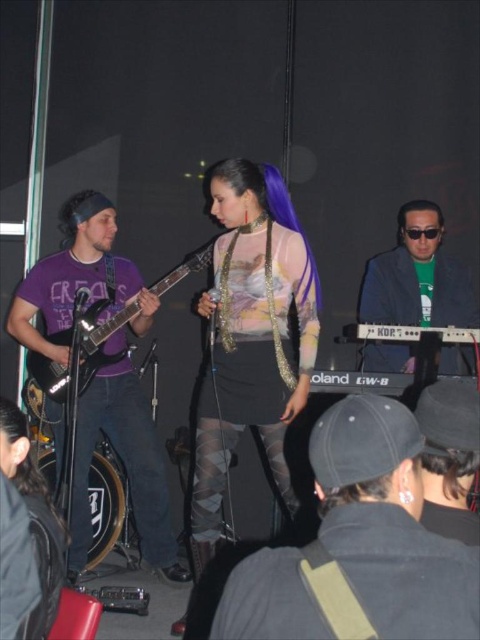
Where is `matte black electric guitar at left`? matte black electric guitar at left is located at coordinates (100, 337).

Does matte black electric guitar at left lie behind purple silky hair at center?

Yes, it is behind purple silky hair at center.

What do you see at coordinates (100, 337) in the screenshot? The height and width of the screenshot is (640, 480). I see `matte black electric guitar at left` at bounding box center [100, 337].

Where is `matte black electric guitar at left`? matte black electric guitar at left is located at coordinates (100, 337).

Which is more to the right, green matte keyboard at center or black silky hair at upper right?

black silky hair at upper right is more to the right.

Is green matte keyboard at center closer to camera compared to black silky hair at upper right?

Yes, it is.

Is point (419, 264) more distant than point (410, 211)?

That is True.

Locate an element on the screen. This screenshot has height=640, width=480. green matte keyboard at center is located at coordinates (417, 276).

In the scene shown: Can you confirm if black fabric cap at lower right is smaller than matte black electric guitar at left?

Indeed, black fabric cap at lower right has a smaller size compared to matte black electric guitar at left.

Looking at this image, how far apart are black fabric cap at lower right and matte black electric guitar at left?

The distance of black fabric cap at lower right from matte black electric guitar at left is 6.10 feet.

Who is more distant from viewer, (x=477, y=428) or (x=38, y=369)?

Point (x=38, y=369)

Where is `black fabric cap at lower right`? This screenshot has height=640, width=480. black fabric cap at lower right is located at coordinates (450, 456).